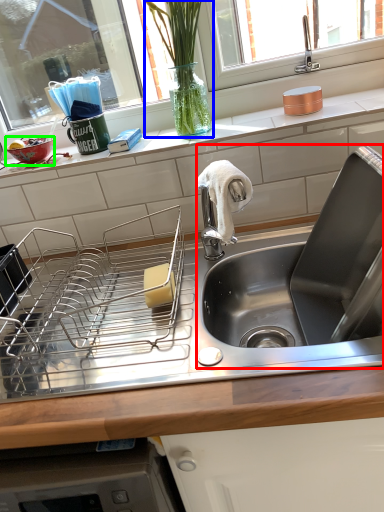
Question: Estimate the real-world distances between objects in this image. Which object is farther from sink (highlighted by a red box), plant (highlighted by a blue box) or basin (highlighted by a green box)?

Choices:
 (A) plant
 (B) basin

Answer: (B)